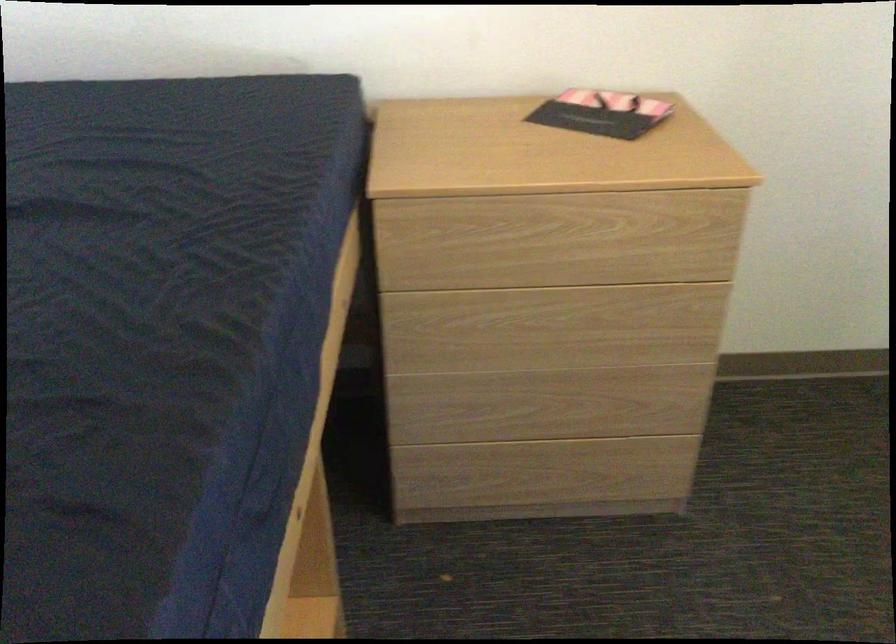
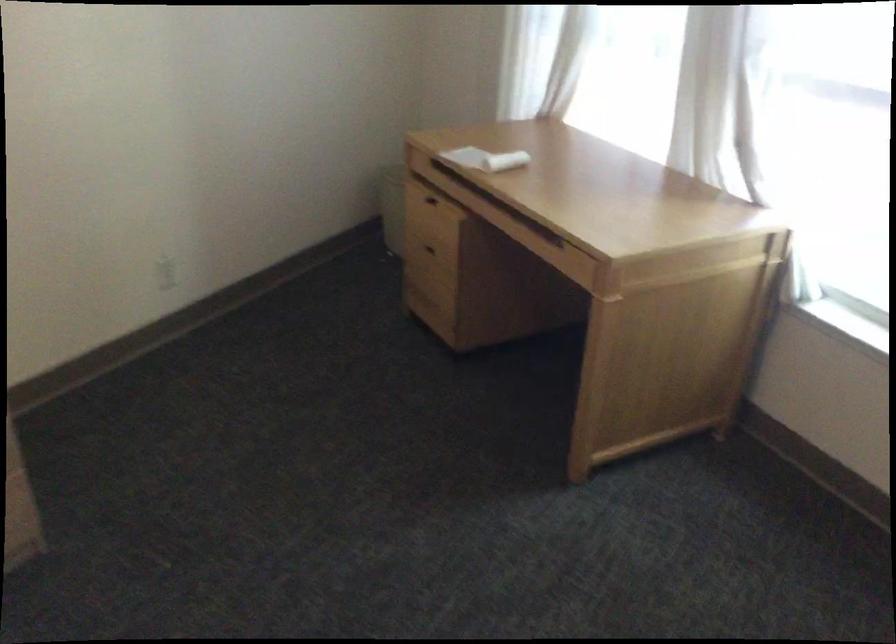
Question: The camera is either moving clockwise (left) or counter-clockwise (right) around the object. The first image is from the beginning of the video and the second image is from the end. Is the camera moving left or right when shooting the video?

Choices:
 (A) Left
 (B) Right

Answer: (A)